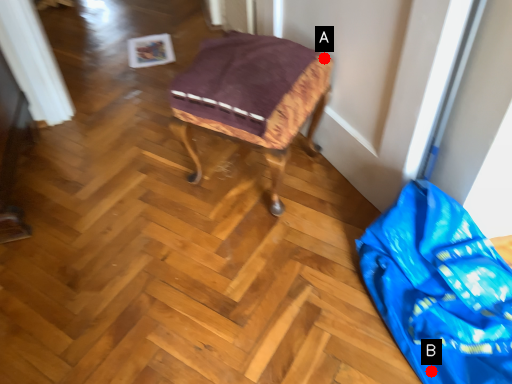
Question: Two points are circled on the image, labeled by A and B beside each circle. Which point is farther from the camera taking this photo?

Choices:
 (A) A is further
 (B) B is further

Answer: (A)